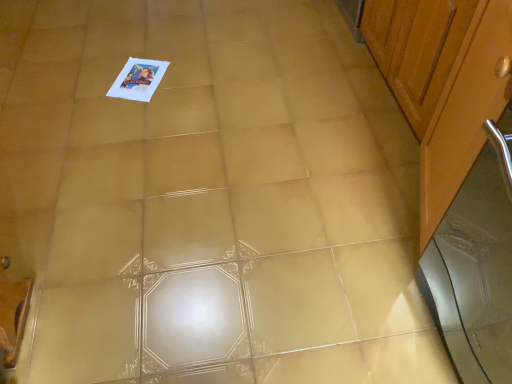
Question: Is wooden cabinet at right, the 1th cabinetry viewed from the back, behind wooden cabinet at right, placed as the 1th cabinetry when sorted from front to back?

Choices:
 (A) no
 (B) yes

Answer: (B)

Question: Does wooden cabinet at right, which is the second cabinetry in front-to-back order, have a lesser height compared to wooden cabinet at right, the second cabinetry when ordered from back to front?

Choices:
 (A) no
 (B) yes

Answer: (B)

Question: From a real-world perspective, is wooden cabinet at right, which is the second cabinetry in front-to-back order, physically above wooden cabinet at right, placed as the 1th cabinetry when sorted from front to back?

Choices:
 (A) no
 (B) yes

Answer: (A)

Question: Is wooden cabinet at right, which is the second cabinetry in front-to-back order, positioned in front of wooden cabinet at right, the second cabinetry when ordered from back to front?

Choices:
 (A) yes
 (B) no

Answer: (B)

Question: From the image's perspective, is wooden cabinet at right, the 1th cabinetry viewed from the back, located above wooden cabinet at right, placed as the 1th cabinetry when sorted from front to back?

Choices:
 (A) yes
 (B) no

Answer: (A)

Question: Is wooden cabinet at right, which is the second cabinetry in front-to-back order, turned away from wooden cabinet at right, placed as the 1th cabinetry when sorted from front to back?

Choices:
 (A) no
 (B) yes

Answer: (A)

Question: From the image's perspective, is silver metallic screen door at right located above wooden cabinet at right, which is the second cabinetry in front-to-back order?

Choices:
 (A) yes
 (B) no

Answer: (B)

Question: Can you confirm if silver metallic screen door at right is smaller than wooden cabinet at right, the 1th cabinetry viewed from the back?

Choices:
 (A) yes
 (B) no

Answer: (A)

Question: From the image's perspective, is silver metallic screen door at right located beneath wooden cabinet at right, which is the second cabinetry in front-to-back order?

Choices:
 (A) yes
 (B) no

Answer: (A)

Question: Would you say silver metallic screen door at right is outside wooden cabinet at right, the 1th cabinetry viewed from the back?

Choices:
 (A) no
 (B) yes

Answer: (B)

Question: Is silver metallic screen door at right further to the viewer compared to wooden cabinet at right, which is the second cabinetry in front-to-back order?

Choices:
 (A) yes
 (B) no

Answer: (B)

Question: Considering the relative sizes of silver metallic screen door at right and wooden cabinet at right, which is the second cabinetry in front-to-back order, in the image provided, is silver metallic screen door at right taller than wooden cabinet at right, which is the second cabinetry in front-to-back order,?

Choices:
 (A) yes
 (B) no

Answer: (A)

Question: Is silver metallic screen door at right oriented towards wooden cabinet at right, placed as the 1th cabinetry when sorted from front to back?

Choices:
 (A) no
 (B) yes

Answer: (A)